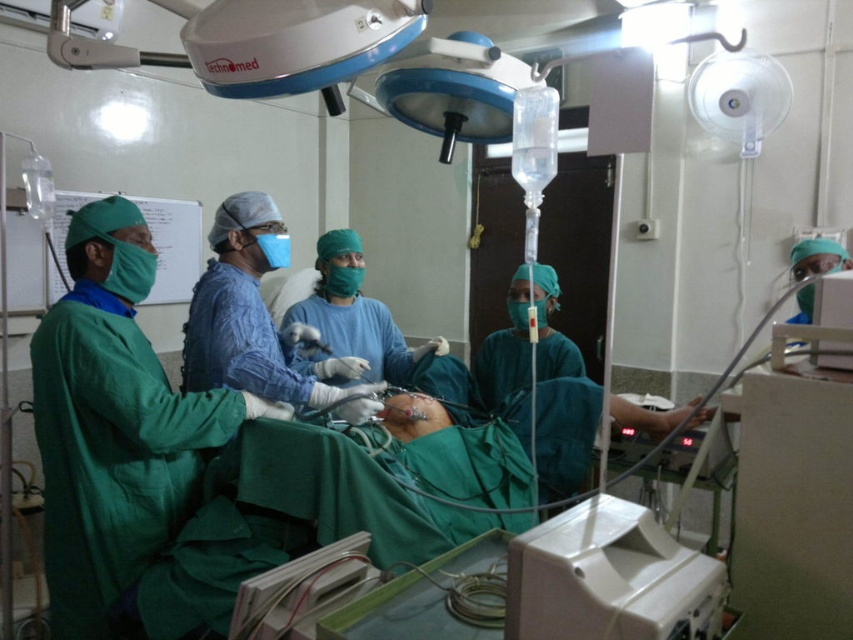
You are a medical student observing a surgery. You notice the green surgical gown at left and the white plastic monitor at lower center. Which object is taller in the image?

The green surgical gown at left is taller than the white plastic monitor at lower center according to the description.

You are a surgical nurse preparing to sterilize the green matte surgical gown at center and the white plastic cables at center. Which item requires more space on the sterilization tray based on their dimensions?

The green matte surgical gown at center might be wider than white plastic cables at center, so it likely requires more space on the sterilization tray.

You are a surgeon in the operating room and need to access two points during a procedure. The first point is at coordinates point (120, 346) and the second is at point (223, 227). Which point is closer to you?

Point (120, 346) is closer to the viewer than point (223, 227).